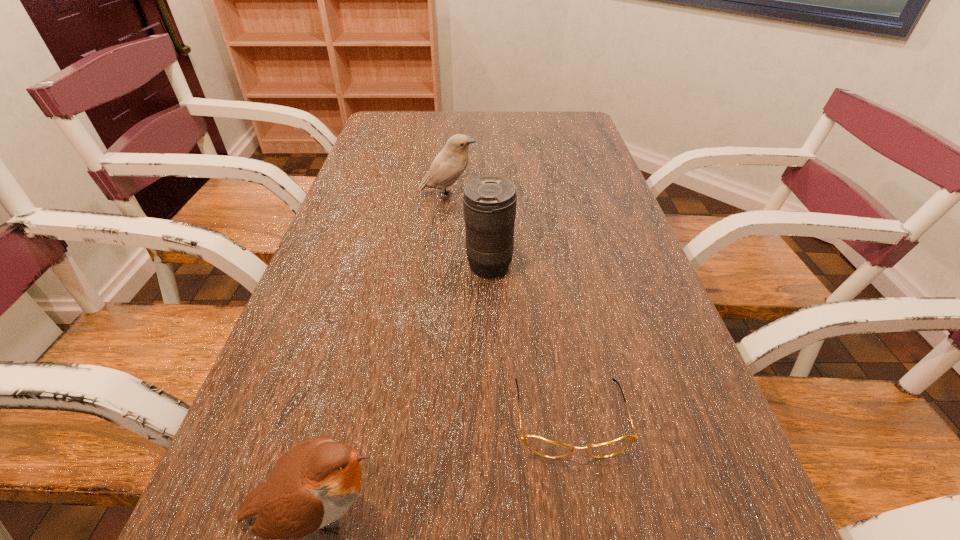
The height and width of the screenshot is (540, 960). I want to click on telephoto lens, so [x=489, y=202].

Find the location of a particular element. the farther bird is located at coordinates (450, 163).

This screenshot has height=540, width=960. What are the coordinates of `spectacles` in the screenshot? It's located at (543, 447).

At what (x,y) coordinates should I click in order to perform the action: click on the shortest object. Please return your answer as a coordinate pair (x, y). Image resolution: width=960 pixels, height=540 pixels. Looking at the image, I should click on (543, 447).

The width and height of the screenshot is (960, 540). Identify the location of free spot located 0.270m on the side of the third nearest object where the control switches are located. (345, 265).

Image resolution: width=960 pixels, height=540 pixels. I want to click on vacant space located on the side of the third nearest object where the control switches are located, so click(394, 265).

You are a GUI agent. You are given a task and a screenshot of the screen. Output one action in this format:
    pyautogui.click(x=<x>, y=<y>)
    Task: Click on the free region located 0.200m on the side of the third nearest object where the control switches are located
    This screenshot has width=960, height=540.
    Given the screenshot: What is the action you would take?
    pyautogui.click(x=376, y=265)

Where is `vacant space located 0.320m at the beak of the farthest object`? Image resolution: width=960 pixels, height=540 pixels. vacant space located 0.320m at the beak of the farthest object is located at coordinates (593, 196).

Locate an element on the screen. free space located 0.060m on the front-facing side of the second nearest object is located at coordinates (585, 504).

The height and width of the screenshot is (540, 960). Identify the location of object at the right edge. (543, 447).